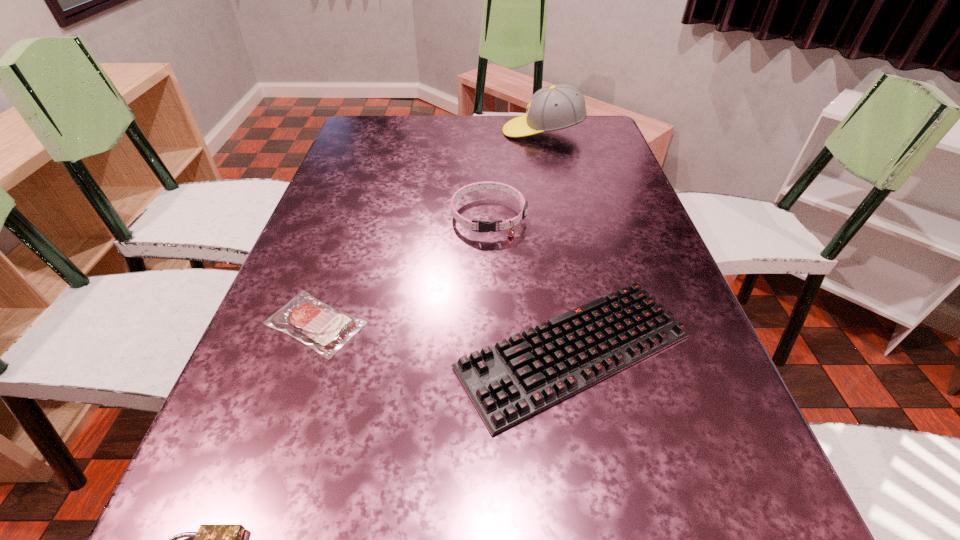
The height and width of the screenshot is (540, 960). What are the coordinates of `free space at the right edge of the desktop` in the screenshot? It's located at (676, 285).

At what (x,y) coordinates should I click in order to perform the action: click on vacant point at the far right corner. Please return your answer as a coordinate pair (x, y). Image resolution: width=960 pixels, height=540 pixels. Looking at the image, I should click on (589, 119).

Image resolution: width=960 pixels, height=540 pixels. I want to click on vacant space that's between the dog collar and the computer keyboard, so click(531, 284).

Find the location of a particular element. This screenshot has height=540, width=960. vacant area that lies between the steak and the baseball cap is located at coordinates (429, 227).

Where is `vacant area that lies between the third tallest object and the baseball cap`? This screenshot has height=540, width=960. vacant area that lies between the third tallest object and the baseball cap is located at coordinates click(558, 241).

Image resolution: width=960 pixels, height=540 pixels. Identify the location of free space between the computer keyboard and the steak. (444, 338).

In order to click on free space between the fourth nearest object and the steak in this screenshot , I will do `click(402, 269)`.

At what (x,y) coordinates should I click in order to perform the action: click on free space between the second tallest object and the baseball cap. Please return your answer as a coordinate pair (x, y). Looking at the image, I should click on (516, 174).

In order to click on empty space that is in between the second tallest object and the third tallest object in this screenshot , I will do `click(531, 284)`.

This screenshot has width=960, height=540. I want to click on the closest object to the third tallest object, so click(483, 226).